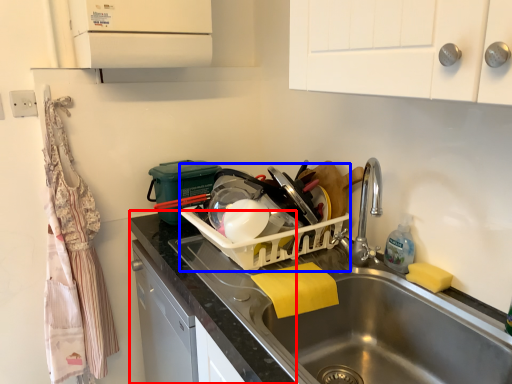
Question: Which of the following is the farthest to the observer, counter top (highlighted by a red box) or appliance (highlighted by a blue box)?

Choices:
 (A) counter top
 (B) appliance

Answer: (B)